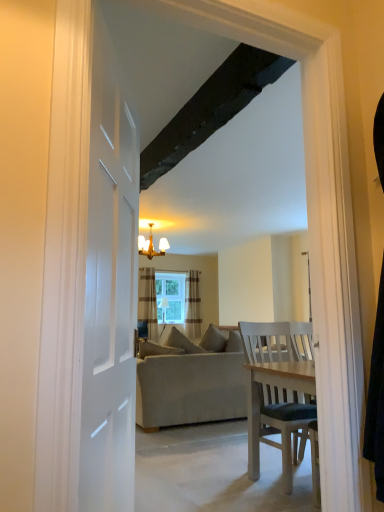
Question: Which direction should I rotate to look at striped fabric curtain at center, the 2th curtain in the left-to-right sequence?

Choices:
 (A) left
 (B) right

Answer: (B)

Question: Is striped fabric curtain at center, the 2th curtain in the left-to-right sequence, facing towards brown striped curtain at center, the 2th curtain viewed from the right?

Choices:
 (A) no
 (B) yes

Answer: (A)

Question: Is the position of striped fabric curtain at center, the 2th curtain in the left-to-right sequence, less distant than that of brown striped curtain at center, the 2th curtain viewed from the right?

Choices:
 (A) yes
 (B) no

Answer: (B)

Question: Is striped fabric curtain at center, positioned as the 1th curtain in right-to-left order, positioned with its back to brown striped curtain at center, the 2th curtain viewed from the right?

Choices:
 (A) no
 (B) yes

Answer: (A)

Question: Would you say striped fabric curtain at center, the 2th curtain in the left-to-right sequence, contains brown striped curtain at center, the 2th curtain viewed from the right?

Choices:
 (A) no
 (B) yes

Answer: (A)

Question: Does striped fabric curtain at center, positioned as the 1th curtain in right-to-left order, appear on the left side of brown striped curtain at center, the 2th curtain viewed from the right?

Choices:
 (A) yes
 (B) no

Answer: (B)

Question: Can you confirm if striped fabric curtain at center, positioned as the 1th curtain in right-to-left order, is thinner than brown striped curtain at center, the 2th curtain viewed from the right?

Choices:
 (A) yes
 (B) no

Answer: (A)

Question: Is gold metallic chandelier at upper center far from striped fabric curtain at center, positioned as the 1th curtain in right-to-left order?

Choices:
 (A) yes
 (B) no

Answer: (A)

Question: Would you say gold metallic chandelier at upper center contains striped fabric curtain at center, positioned as the 1th curtain in right-to-left order?

Choices:
 (A) no
 (B) yes

Answer: (A)

Question: Does gold metallic chandelier at upper center have a larger size compared to striped fabric curtain at center, the 2th curtain in the left-to-right sequence?

Choices:
 (A) yes
 (B) no

Answer: (A)

Question: Is gold metallic chandelier at upper center at the right side of striped fabric curtain at center, positioned as the 1th curtain in right-to-left order?

Choices:
 (A) no
 (B) yes

Answer: (A)

Question: Does gold metallic chandelier at upper center have a greater width compared to striped fabric curtain at center, the 2th curtain in the left-to-right sequence?

Choices:
 (A) yes
 (B) no

Answer: (A)

Question: Is gold metallic chandelier at upper center shorter than striped fabric curtain at center, positioned as the 1th curtain in right-to-left order?

Choices:
 (A) yes
 (B) no

Answer: (A)

Question: From the image's perspective, would you say gold metallic chandelier at upper center is shown under clear glass window at center?

Choices:
 (A) yes
 (B) no

Answer: (B)